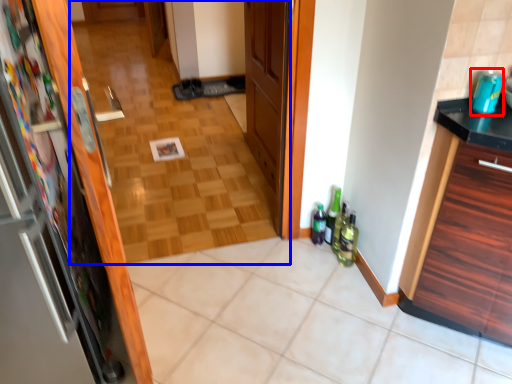
Question: Among these objects, which one is nearest to the camera, beverage (highlighted by a red box) or corridor (highlighted by a blue box)?

Choices:
 (A) beverage
 (B) corridor

Answer: (A)